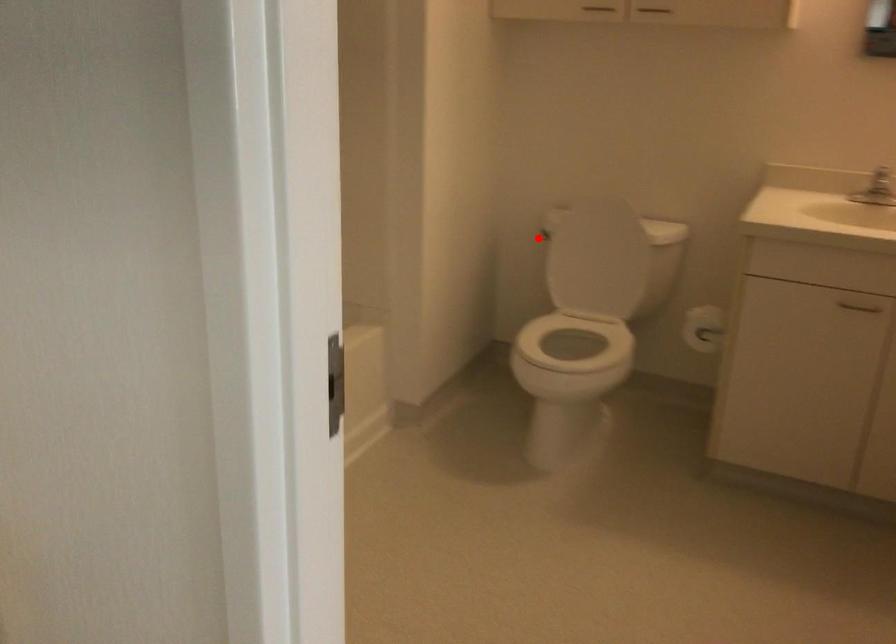
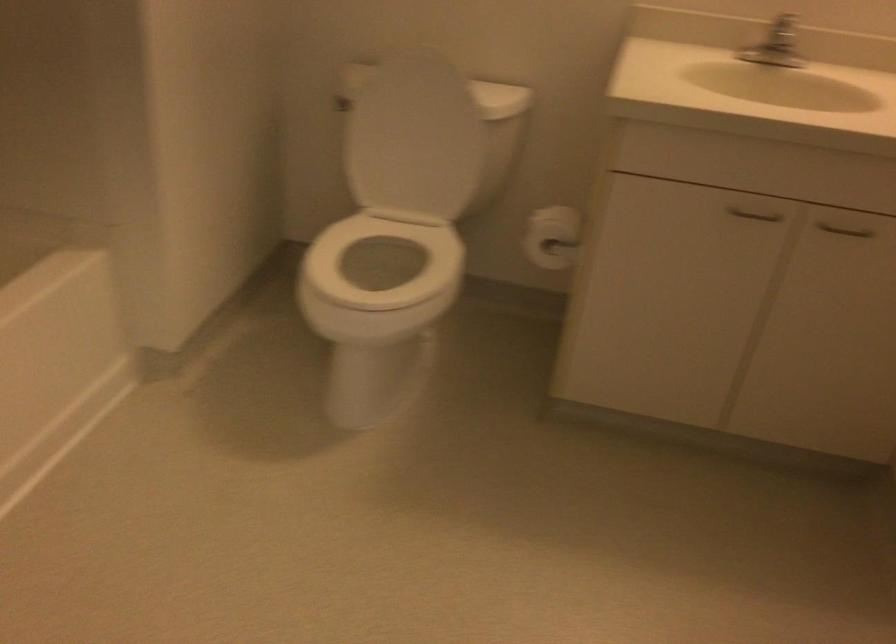
Where in the second image is the point corresponding to the highlighted location from the first image?

(340, 104)